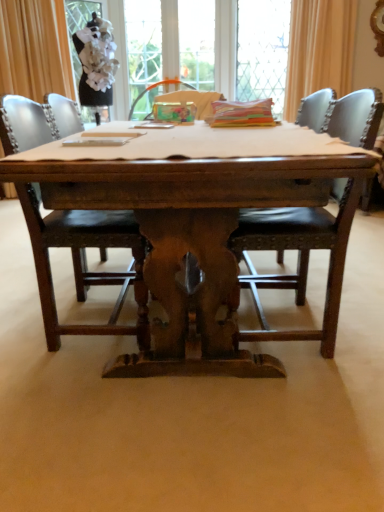
This screenshot has width=384, height=512. What do you see at coordinates (193, 218) in the screenshot? I see `wooden table at center` at bounding box center [193, 218].

At what (x,y) coordinates should I click in order to perform the action: click on smooth wooden table at center. Please return your answer as a coordinate pair (x, y). Looking at the image, I should click on (192, 169).

You are a GUI agent. You are given a task and a screenshot of the screen. Output one action in this format:
    pyautogui.click(x=<x>, y=<y>)
    Task: Click on the orange fabric curtain at upper right, placed as the 1th curtain when sorted from right to left
    The height and width of the screenshot is (512, 384).
    Given the screenshot: What is the action you would take?
    pyautogui.click(x=319, y=49)

Identify the location of leather cushioned chair at right, which appears as the 1th chair when viewed from the right. (294, 238).

Locate an element on the screen. The image size is (384, 512). wooden table at center is located at coordinates (193, 218).

Considering the relative positions of matte gold curtain at upper left, which ranks as the second curtain in right-to-left order, and wooden table at center in the image provided, is matte gold curtain at upper left, which ranks as the second curtain in right-to-left order, behind wooden table at center?

Yes.

Considering the sizes of objects matte gold curtain at upper left, which ranks as the second curtain in right-to-left order, and wooden table at center in the image provided, who is shorter, matte gold curtain at upper left, which ranks as the second curtain in right-to-left order, or wooden table at center?

wooden table at center is shorter.

Does matte gold curtain at upper left, which ranks as the second curtain in right-to-left order, turn towards wooden table at center?

Yes, matte gold curtain at upper left, which ranks as the second curtain in right-to-left order, is turned towards wooden table at center.

What are the coordinates of `table below the matte gold curtain at upper left, which ranks as the second curtain in right-to-left order (from the image's perspective)` in the screenshot? It's located at (193, 218).

From the picture: Is clear glass window screen at upper center shorter than white fabric screen door at upper left?

No.

What are the coordinates of `window screen above the white fabric screen door at upper left (from a real-world perspective)` in the screenshot? It's located at (262, 51).

From the picture: Which of these two, clear glass window screen at upper center or white fabric screen door at upper left, is wider?

With larger width is white fabric screen door at upper left.

Is smooth wooden table at center taller than matte gold curtain at upper left, positioned as the 1th curtain in left-to-right order?

Incorrect, the height of smooth wooden table at center is not larger of that of matte gold curtain at upper left, positioned as the 1th curtain in left-to-right order.

Is smooth wooden table at center in contact with matte gold curtain at upper left, which ranks as the second curtain in right-to-left order?

No, smooth wooden table at center is not beside matte gold curtain at upper left, which ranks as the second curtain in right-to-left order.

Is the position of smooth wooden table at center less distant than that of matte gold curtain at upper left, positioned as the 1th curtain in left-to-right order?

Yes, the depth of smooth wooden table at center is less than that of matte gold curtain at upper left, positioned as the 1th curtain in left-to-right order.

Considering the relative positions of smooth wooden table at center and matte gold curtain at upper left, positioned as the 1th curtain in left-to-right order, in the image provided, is smooth wooden table at center to the left of matte gold curtain at upper left, positioned as the 1th curtain in left-to-right order, from the viewer's perspective?

No, smooth wooden table at center is not to the left of matte gold curtain at upper left, positioned as the 1th curtain in left-to-right order.

Between smooth wooden table at center and orange fabric curtain at upper right, the second curtain positioned from the left, which one has less height?

smooth wooden table at center.

Is smooth wooden table at center positioned far away from orange fabric curtain at upper right, the second curtain positioned from the left?

That's right, there is a large distance between smooth wooden table at center and orange fabric curtain at upper right, the second curtain positioned from the left.

In terms of width, does smooth wooden table at center look wider or thinner when compared to orange fabric curtain at upper right, placed as the 1th curtain when sorted from right to left?

In the image, smooth wooden table at center appears to be wider than orange fabric curtain at upper right, placed as the 1th curtain when sorted from right to left.

How different are the orientations of smooth wooden table at center and orange fabric curtain at upper right, placed as the 1th curtain when sorted from right to left, in degrees?

The angular difference between smooth wooden table at center and orange fabric curtain at upper right, placed as the 1th curtain when sorted from right to left, is 46.2 degrees.

Is orange fabric curtain at upper right, placed as the 1th curtain when sorted from right to left, positioned with its back to leather cushioned chair at right, which appears as the 1th chair when viewed from the right?

No, leather cushioned chair at right, which appears as the 1th chair when viewed from the right, is not at the back of orange fabric curtain at upper right, placed as the 1th curtain when sorted from right to left.

From a real-world perspective, is orange fabric curtain at upper right, placed as the 1th curtain when sorted from right to left, positioned over leather cushioned chair at right, the 2th chair in the left-to-right sequence, based on gravity?

Correct, in the physical world, orange fabric curtain at upper right, placed as the 1th curtain when sorted from right to left, is higher than leather cushioned chair at right, the 2th chair in the left-to-right sequence.

Find the location of a particular element. The image size is (384, 512). the 2nd chair in front of the orange fabric curtain at upper right, placed as the 1th curtain when sorted from right to left, counting from the anchor's position is located at coordinates (294, 238).

Looking at this image, would you say orange fabric curtain at upper right, placed as the 1th curtain when sorted from right to left, is inside or outside clear glass window screen at upper center?

orange fabric curtain at upper right, placed as the 1th curtain when sorted from right to left, is outside clear glass window screen at upper center.

Considering the sizes of objects orange fabric curtain at upper right, placed as the 1th curtain when sorted from right to left, and clear glass window screen at upper center in the image provided, who is bigger, orange fabric curtain at upper right, placed as the 1th curtain when sorted from right to left, or clear glass window screen at upper center?

With larger size is clear glass window screen at upper center.

Based on the photo, considering the relative positions of orange fabric curtain at upper right, the second curtain positioned from the left, and clear glass window screen at upper center in the image provided, is orange fabric curtain at upper right, the second curtain positioned from the left, in front of clear glass window screen at upper center?

Yes, the depth of orange fabric curtain at upper right, the second curtain positioned from the left, is less than that of clear glass window screen at upper center.

Considering the sizes of orange fabric curtain at upper right, the second curtain positioned from the left, and clear glass window screen at upper center in the image, is orange fabric curtain at upper right, the second curtain positioned from the left, taller or shorter than clear glass window screen at upper center?

orange fabric curtain at upper right, the second curtain positioned from the left, is shorter than clear glass window screen at upper center.

Is leather cushioned chair at right, which appears as the 1th chair when viewed from the right, beside white fabric screen door at upper left?

They are not placed beside each other.

In the scene shown: Is leather cushioned chair at right, which appears as the 1th chair when viewed from the right, turned away from white fabric screen door at upper left?

No, leather cushioned chair at right, which appears as the 1th chair when viewed from the right, is not facing away from white fabric screen door at upper left.

From the image's perspective, does leather cushioned chair at right, which appears as the 1th chair when viewed from the right, appear lower than white fabric screen door at upper left?

Yes, from the image's perspective, leather cushioned chair at right, which appears as the 1th chair when viewed from the right, is below white fabric screen door at upper left.

Where is `table below the matte gold curtain at upper left, positioned as the 1th curtain in left-to-right order (from the image's perspective)`? This screenshot has width=384, height=512. table below the matte gold curtain at upper left, positioned as the 1th curtain in left-to-right order (from the image's perspective) is located at coordinates coord(193,218).

Find the location of a particular element. The height and width of the screenshot is (512, 384). window screen that appears behind the white fabric screen door at upper left is located at coordinates (262, 51).

Considering their positions, is matte gold curtain at upper left, positioned as the 1th curtain in left-to-right order, positioned closer to leather cushioned chair at right, the 2th chair in the left-to-right sequence, than clear glass window screen at upper center?

Based on the image, matte gold curtain at upper left, positioned as the 1th curtain in left-to-right order, appears to be nearer to leather cushioned chair at right, the 2th chair in the left-to-right sequence.

Estimate the real-world distances between objects in this image. Which object is further from clear glass window screen at upper center, orange fabric curtain at upper right, the second curtain positioned from the left, or white fabric screen door at upper left?

Based on the image, white fabric screen door at upper left appears to be further to clear glass window screen at upper center.

Looking at the image, which one is located closer to dark brown wood chair at center, the first chair when ordered from left to right, matte gold curtain at upper left, which ranks as the second curtain in right-to-left order, or orange fabric curtain at upper right, the second curtain positioned from the left?

Based on the image, matte gold curtain at upper left, which ranks as the second curtain in right-to-left order, appears to be nearer to dark brown wood chair at center, the first chair when ordered from left to right.

When comparing their distances from orange fabric curtain at upper right, placed as the 1th curtain when sorted from right to left, does dark brown wood chair at center, the first chair when ordered from left to right, or white fabric screen door at upper left seem further?

dark brown wood chair at center, the first chair when ordered from left to right, is further to orange fabric curtain at upper right, placed as the 1th curtain when sorted from right to left.

Based on their spatial positions, is leather cushioned chair at right, the 2th chair in the left-to-right sequence, or wooden table at center further from smooth wooden table at center?

leather cushioned chair at right, the 2th chair in the left-to-right sequence, is positioned further to the anchor smooth wooden table at center.

Looking at the image, which one is located closer to leather cushioned chair at right, the 2th chair in the left-to-right sequence, smooth wooden table at center or clear glass window screen at upper center?

smooth wooden table at center.

Based on their spatial positions, is white fabric screen door at upper left or smooth wooden table at center further from clear glass window screen at upper center?

smooth wooden table at center lies further to clear glass window screen at upper center than the other object.

Looking at the image, which one is located further to smooth wooden table at center, leather cushioned chair at right, the 2th chair in the left-to-right sequence, or dark brown wood chair at center, which is counted as the 2th chair, starting from the right?

dark brown wood chair at center, which is counted as the 2th chair, starting from the right, is further to smooth wooden table at center.

Where is `table top between wooden table at center and orange fabric curtain at upper right, placed as the 1th curtain when sorted from right to left, from front to back`? The height and width of the screenshot is (512, 384). table top between wooden table at center and orange fabric curtain at upper right, placed as the 1th curtain when sorted from right to left, from front to back is located at coordinates coord(192,169).

Find the location of a particular element. The height and width of the screenshot is (512, 384). chair between leather cushioned chair at right, which appears as the 1th chair when viewed from the right, and matte gold curtain at upper left, positioned as the 1th curtain in left-to-right order, from front to back is located at coordinates (85, 262).

Identify the location of window screen located between matte gold curtain at upper left, which ranks as the second curtain in right-to-left order, and orange fabric curtain at upper right, the second curtain positioned from the left, in the left-right direction. (262, 51).

This screenshot has height=512, width=384. Identify the location of screen door between matte gold curtain at upper left, positioned as the 1th curtain in left-to-right order, and orange fabric curtain at upper right, the second curtain positioned from the left, in the horizontal direction. (78, 27).